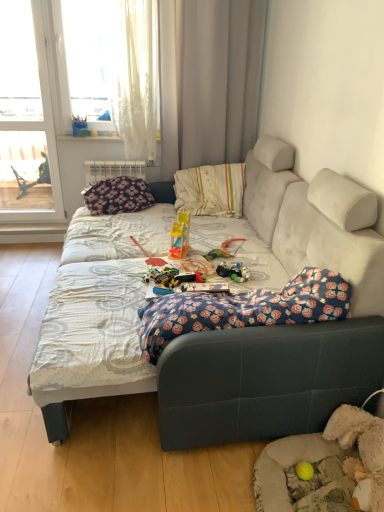
The height and width of the screenshot is (512, 384). What are the coordinates of `free space that is in between velvet gray couch at center and fluffy beige dog bed at lower right` in the screenshot? It's located at (169, 479).